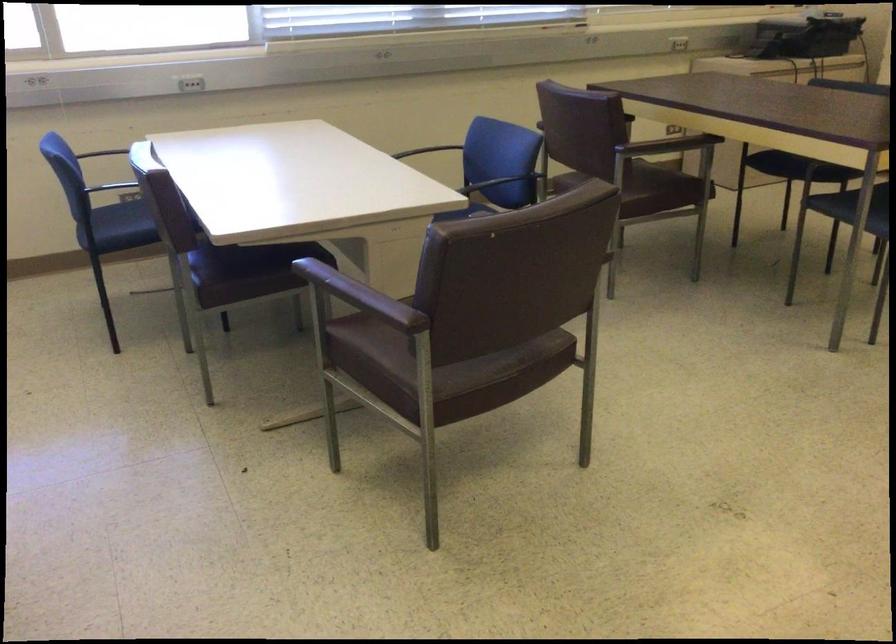
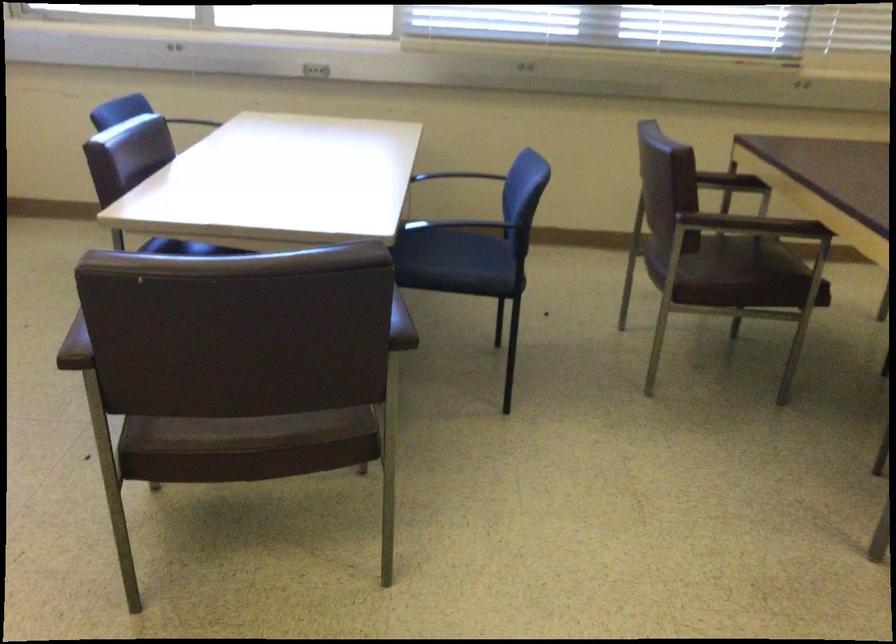
Locate, in the second image, the point that corresponds to point 665,185 in the first image.

(739, 278)